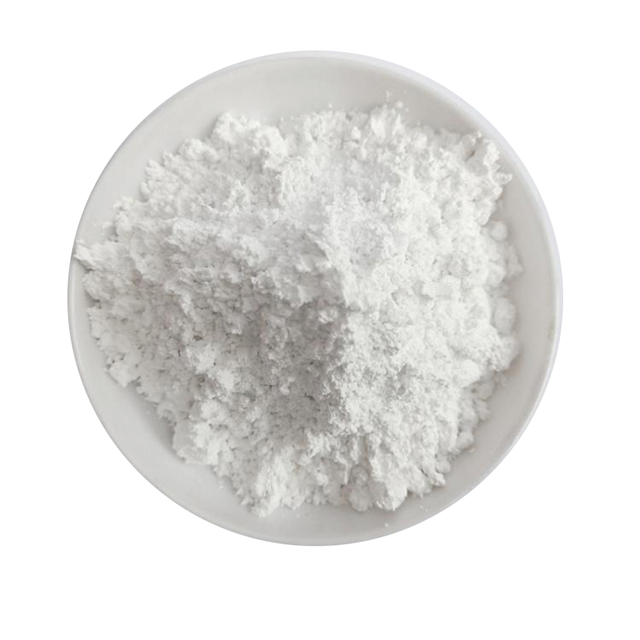
Locate an element on the screen. The image size is (640, 640). top rim of bowl is located at coordinates (310, 54).